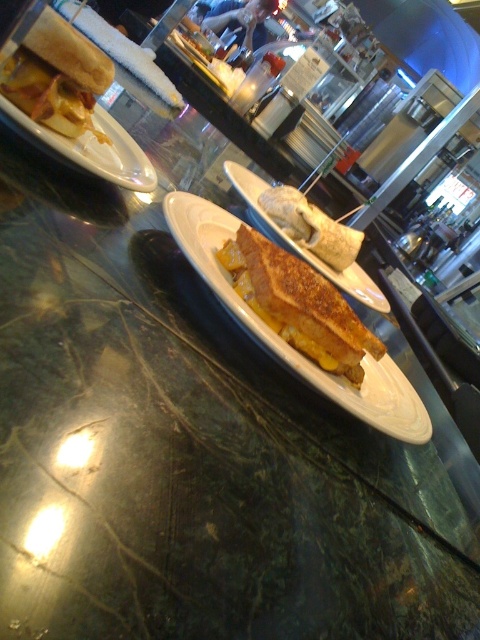
Between golden brown bread at center and matte brown toast at center, which one is positioned higher?

golden brown bread at center is higher up.

Is golden brown bread at center positioned behind matte brown toast at center?

Yes, golden brown bread at center is further from the viewer.

This screenshot has height=640, width=480. What do you see at coordinates (311, 227) in the screenshot?
I see `golden brown bread at center` at bounding box center [311, 227].

Where is `golden brown bread at center`? This screenshot has width=480, height=640. golden brown bread at center is located at coordinates (311, 227).

Which of these two, matte brown bread at upper left or golden brown bread at center, stands taller?

golden brown bread at center

Does matte brown bread at upper left have a lesser height compared to golden brown bread at center?

Correct, matte brown bread at upper left is not as tall as golden brown bread at center.

Who is more distant from viewer, (23, 44) or (302, 195)?

The point (302, 195) is more distant.

The image size is (480, 640). In order to click on matte brown bread at upper left in this screenshot , I will do [x=57, y=77].

In the scene shown: Which is above, grilled cheese sandwich at center or golden brown bread at center?

golden brown bread at center

Measure the distance between grilled cheese sandwich at center and golden brown bread at center.

A distance of 13.44 inches exists between grilled cheese sandwich at center and golden brown bread at center.

Between point (288, 323) and point (327, 246), which one is positioned in front?

Point (288, 323) is more forward.

Where is `grilled cheese sandwich at center`? The image size is (480, 640). grilled cheese sandwich at center is located at coordinates (299, 305).